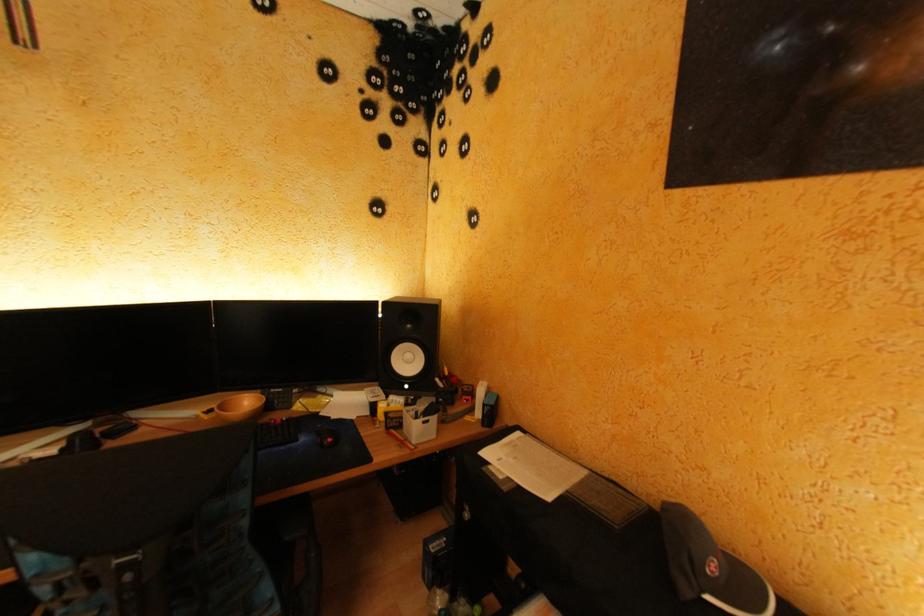
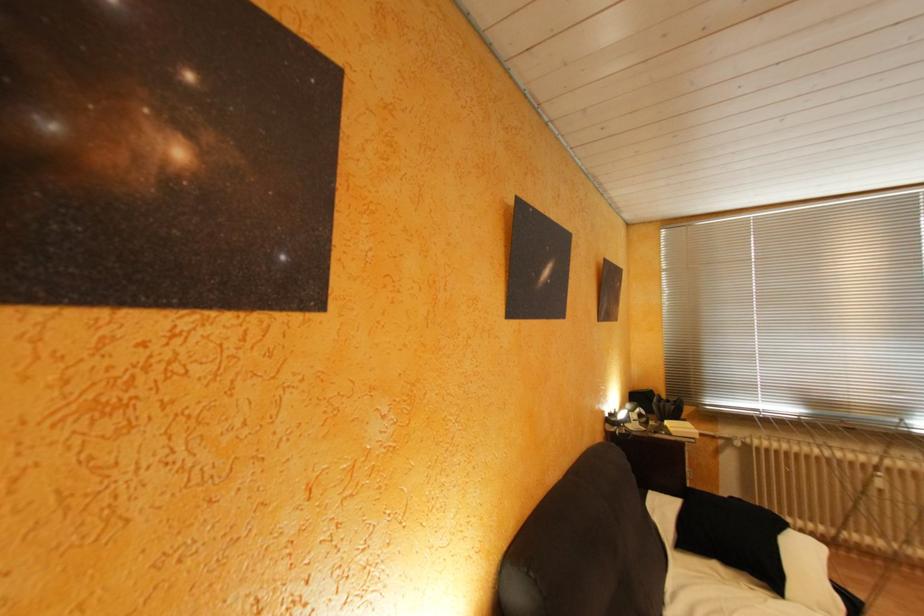
Question: How did the camera likely rotate?

Choices:
 (A) Left
 (B) Right
 (C) Up
 (D) Down

Answer: (B)